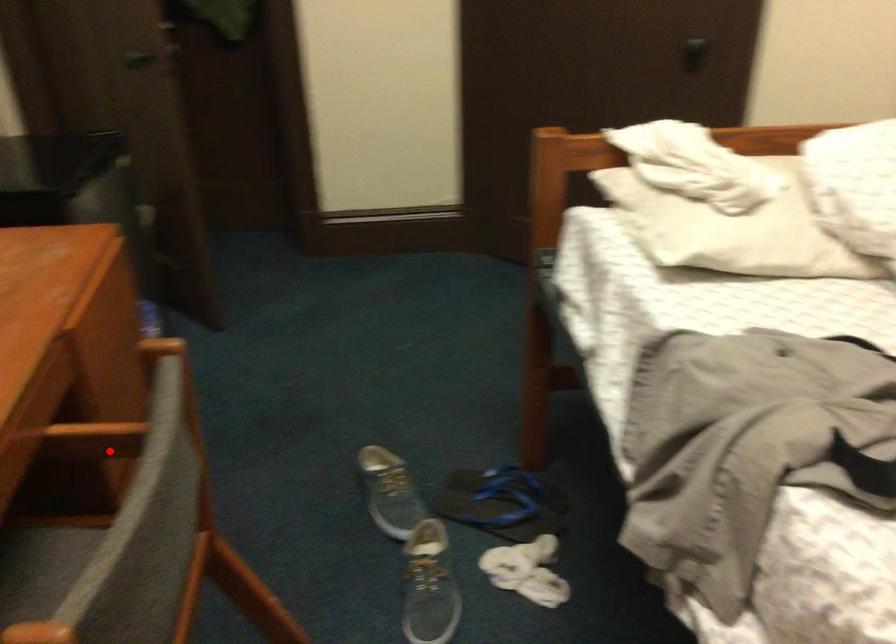
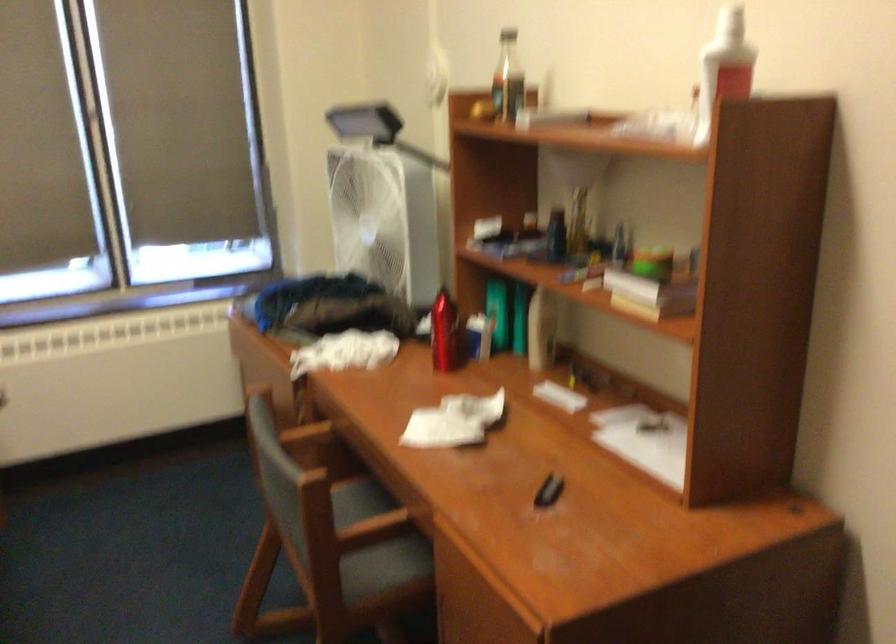
Question: I am providing you with two images of the same scene from different viewpoints. Given a red point in image1, look at the same physical point in image2. Is it:

Choices:
 (A) Closer to the viewpoint
 (B) Farther from the viewpoint

Answer: (B)